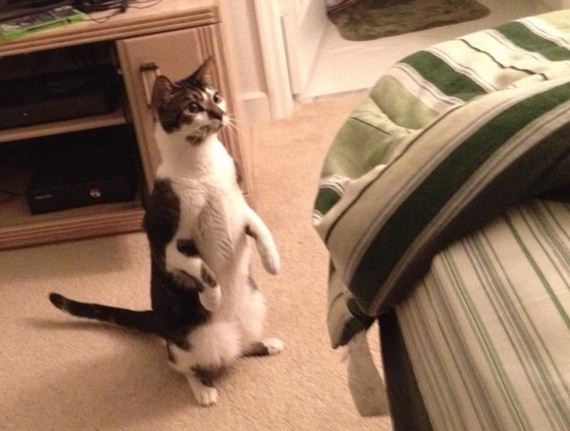
You are a GUI agent. You are given a task and a screenshot of the screen. Output one action in this format:
    pyautogui.click(x=<x>, y=<y>)
    Task: Click on the desk
    The image size is (570, 431).
    Given the screenshot: What is the action you would take?
    pyautogui.click(x=140, y=20)